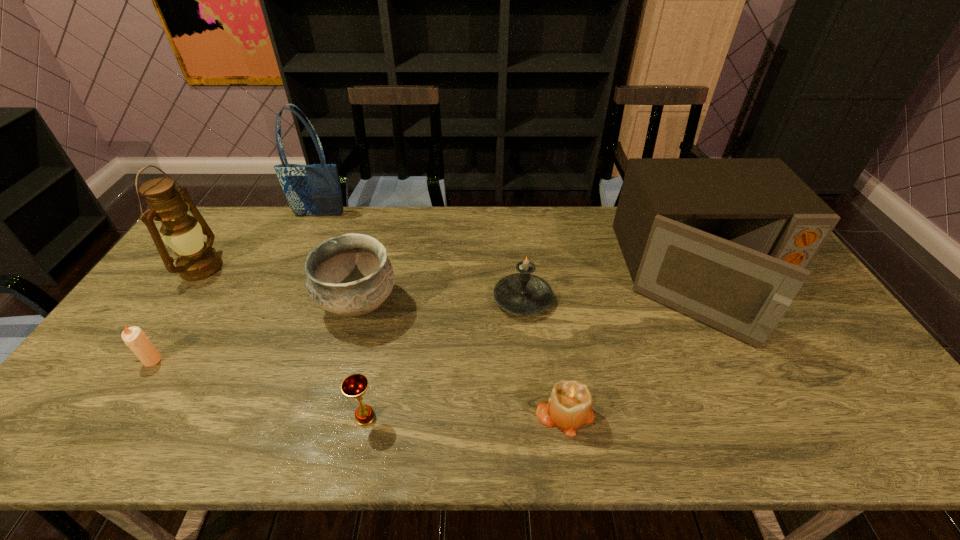
Locate an element on the screen. The image size is (960, 540). free space located 0.160m on the front-facing side of the sixth object from right to left is located at coordinates (305, 247).

Locate an element on the screen. vacant point located on the right of the oil lamp is located at coordinates (250, 267).

Identify the location of vacant space situated with the door open on the front of the third tallest object. (768, 394).

The image size is (960, 540). What are the coordinates of `blank space located on the left of the pottery` in the screenshot? It's located at (258, 305).

Identify the location of vacant space located on the left of the tallest candle. Image resolution: width=960 pixels, height=540 pixels. (432, 299).

Find the location of a particular element. free space located on the right of the leftmost candle is located at coordinates click(x=267, y=360).

You are a GUI agent. You are given a task and a screenshot of the screen. Output one action in this format:
    pyautogui.click(x=<x>, y=<y>)
    Task: Click on the blank area located 0.320m on the left of the chalice
    This screenshot has height=540, width=960.
    Given the screenshot: What is the action you would take?
    pyautogui.click(x=214, y=417)

This screenshot has height=540, width=960. In order to click on free location located 0.240m on the left of the nearest candle in this screenshot , I will do `click(431, 413)`.

Where is `shopping bag situated at the far edge`? The image size is (960, 540). shopping bag situated at the far edge is located at coordinates (311, 190).

This screenshot has height=540, width=960. Identify the location of microwave oven that is at the far edge. (728, 241).